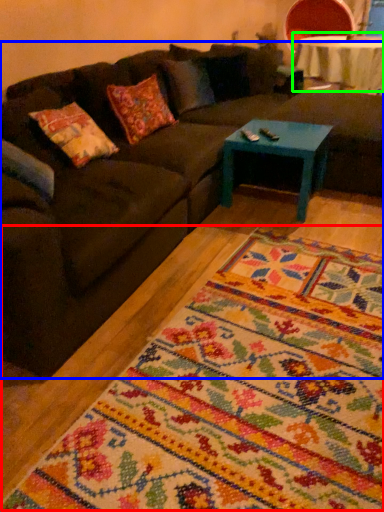
Question: Considering the real-world distances, which object is closest to mat (highlighted by a red box)? studio couch (highlighted by a blue box) or table (highlighted by a green box).

Choices:
 (A) studio couch
 (B) table

Answer: (A)